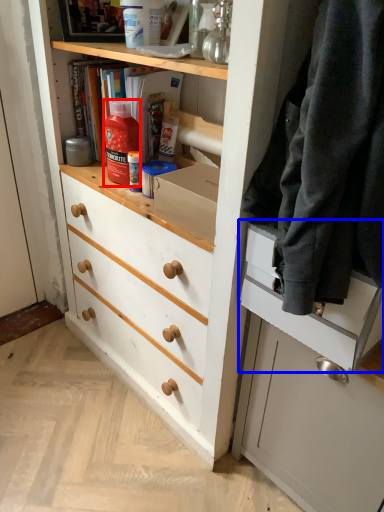
Question: Which object appears farthest to the camera in this image, bottle (highlighted by a red box) or drawer (highlighted by a blue box)?

Choices:
 (A) bottle
 (B) drawer

Answer: (A)